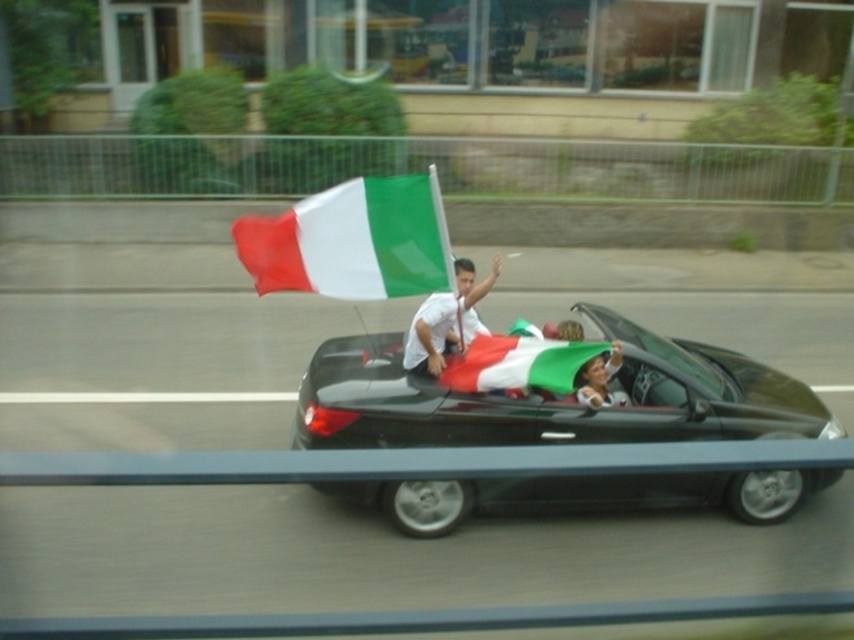
Question: Among these objects, which one is nearest to the camera?

Choices:
 (A) matte fabric flag at center
 (B) white matte shirt at center

Answer: (A)

Question: Among these objects, which one is farthest from the camera?

Choices:
 (A) shiny black convertible at center
 (B) white matte shirt at center

Answer: (B)

Question: Is shiny black convertible at center positioned in front of white matte shirt at center?

Choices:
 (A) yes
 (B) no

Answer: (A)

Question: Does matte fabric flag at center have a smaller size compared to matte white shirt at center?

Choices:
 (A) no
 (B) yes

Answer: (B)

Question: Is shiny black convertible at center smaller than green fabric flag at center?

Choices:
 (A) yes
 (B) no

Answer: (B)

Question: Based on their relative distances, which object is farther from the matte white shirt at center?

Choices:
 (A) matte fabric flag at center
 (B) shiny black convertible at center
 (C) white matte shirt at center

Answer: (A)